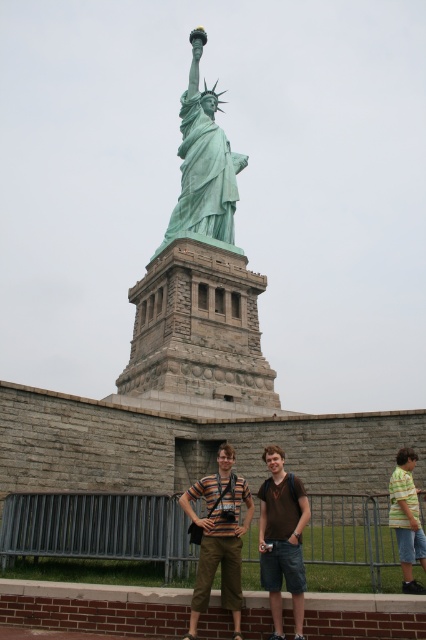
Who is positioned more to the right, green patina statue at center or yellow-green striped shirt at lower right?

yellow-green striped shirt at lower right is more to the right.

Identify the location of green patina statue at center. (204, 164).

Identify the location of green patina statue at center. (204, 164).

Image resolution: width=426 pixels, height=640 pixels. In order to click on green patina statue at center in this screenshot , I will do `click(204, 164)`.

Can you confirm if green patina statue at center is smaller than brown cotton t-shirt at center?

Actually, green patina statue at center might be larger than brown cotton t-shirt at center.

Can you confirm if green patina statue at center is thinner than brown cotton t-shirt at center?

In fact, green patina statue at center might be wider than brown cotton t-shirt at center.

What do you see at coordinates (204, 164) in the screenshot?
I see `green patina statue at center` at bounding box center [204, 164].

The height and width of the screenshot is (640, 426). I want to click on green patina statue at center, so click(x=204, y=164).

Is striped cotton shirt at center thinner than yellow-green striped shirt at lower right?

No.

Between point (207, 568) and point (399, 480), which one is positioned behind?

The point (399, 480) is more distant.

This screenshot has height=640, width=426. I want to click on striped cotton shirt at center, so click(x=218, y=538).